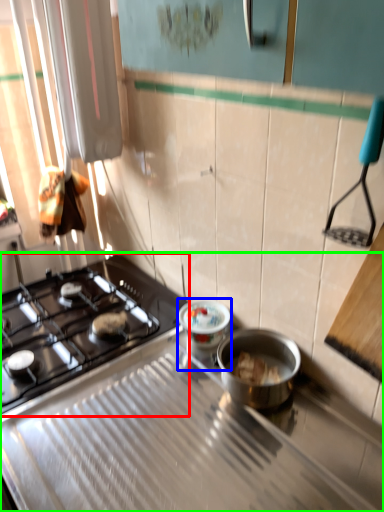
Question: Considering the real-world distances, which object is closest to gas stove (highlighted by a red box)? appliance (highlighted by a blue box) or gas stove (highlighted by a green box).

Choices:
 (A) appliance
 (B) gas stove

Answer: (B)